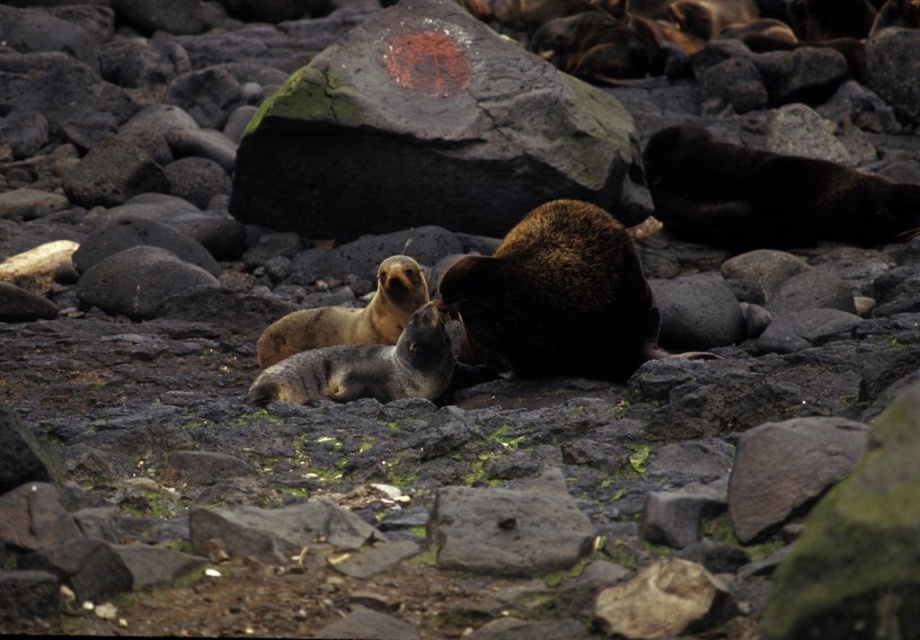
Question: Can you confirm if brown fuzzy seal at upper right is positioned to the right of gray fur seal at center?

Choices:
 (A) no
 (B) yes

Answer: (B)

Question: Which object is closer to the camera taking this photo?

Choices:
 (A) brown fuzzy seal at center
 (B) golden fur seal at center
 (C) dark gray textured rock at center
 (D) gray fur seal at center

Answer: (D)

Question: Can you confirm if gray fur seal at center is positioned to the right of golden fur seal at center?

Choices:
 (A) no
 (B) yes

Answer: (B)

Question: Considering the real-world distances, which object is closest to the gray fur seal at center?

Choices:
 (A) golden fur seal at center
 (B) brown fuzzy seal at upper right

Answer: (A)

Question: Does brown fuzzy seal at center appear on the left side of gray fur seal at center?

Choices:
 (A) no
 (B) yes

Answer: (A)

Question: Which is farther from the brown fuzzy seal at center?

Choices:
 (A) golden fur seal at center
 (B) dark gray textured rock at center
 (C) brown fuzzy seal at upper right
 (D) gray fur seal at center

Answer: (C)